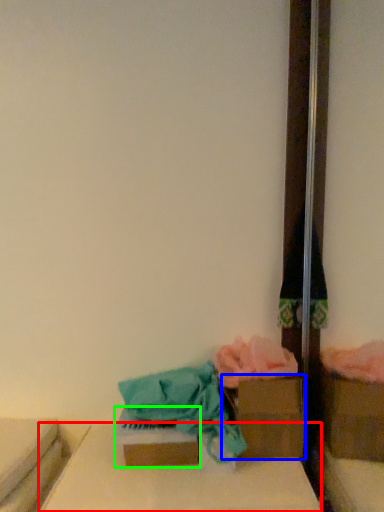
Question: Which object is positioned closest to furniture (highlighted by a red box)? Select from storage box (highlighted by a blue box) and storage box (highlighted by a green box).

Choices:
 (A) storage box
 (B) storage box

Answer: (B)